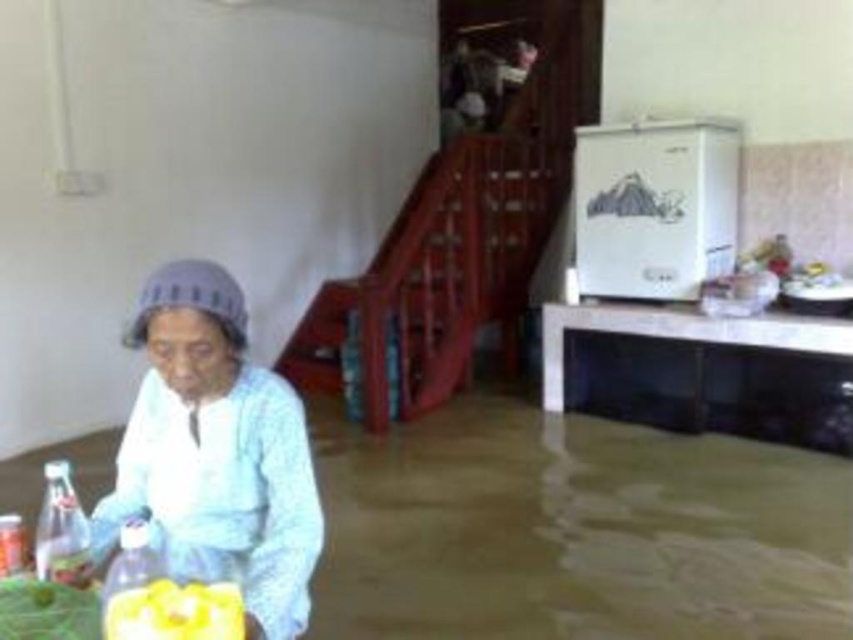
Looking at this image, which is below, white glossy table at lower right or yellow matte juice at lower left?

white glossy table at lower right is lower down.

The width and height of the screenshot is (853, 640). In order to click on white glossy table at lower right in this screenshot , I will do `click(701, 369)`.

At what (x,y) coordinates should I click in order to perform the action: click on white glossy table at lower right. Please return your answer as a coordinate pair (x, y). The width and height of the screenshot is (853, 640). Looking at the image, I should click on (701, 369).

Find the location of a particular element. The image size is (853, 640). white glossy table at lower right is located at coordinates (701, 369).

Can you confirm if white cotton shirt at lower left is bigger than white glossy table at lower right?

Actually, white cotton shirt at lower left might be smaller than white glossy table at lower right.

Where is `white cotton shirt at lower left`? white cotton shirt at lower left is located at coordinates (216, 452).

Locate an element on the screen. Image resolution: width=853 pixels, height=640 pixels. white cotton shirt at lower left is located at coordinates (216, 452).

Does point (227, 541) come in front of point (128, 600)?

No, it is behind (128, 600).

Who is shorter, white cotton shirt at lower left or yellow matte juice at lower left?

yellow matte juice at lower left

Who is more distant from viewer, (132,502) or (149,580)?

Positioned behind is point (132,502).

Identify the location of white cotton shirt at lower left. (216, 452).